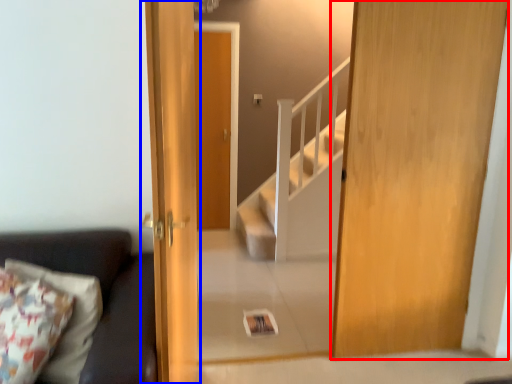
Question: Which object appears closest to the camera in this image, door (highlighted by a red box) or door (highlighted by a blue box)?

Choices:
 (A) door
 (B) door

Answer: (B)